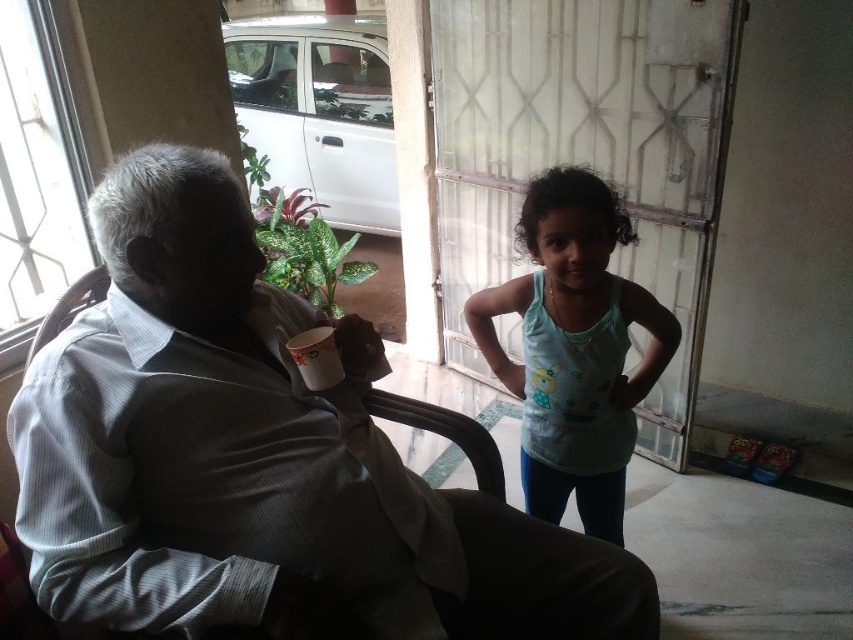
You are trying to move the brown fabric chair at left through the transparent plastic screen door at center. Will the chair fit through the door?

The transparent plastic screen door at center is wider than the brown fabric chair at left, so the chair will fit through the door.

You are a photographer trying to capture a closeup of the white glossy cup at upper center without including the brown fabric chair at left in the frame. Based on their positions, is this possible?

The white glossy cup at upper center is positioned on the right side of the brown fabric chair at left, so it is possible to capture a closeup of the white glossy cup at upper center without including the brown fabric chair at left in the frame.